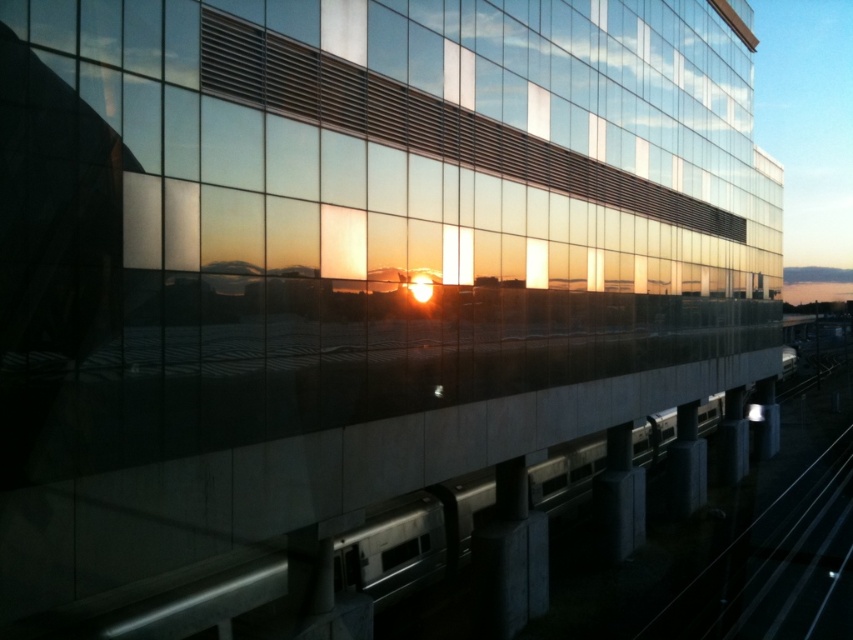
Is black metal train track at lower right wider than silver metallic train at center?

No, black metal train track at lower right is not wider than silver metallic train at center.

Does black metal train track at lower right have a greater height compared to silver metallic train at center?

No.

I want to click on black metal train track at lower right, so click(x=778, y=566).